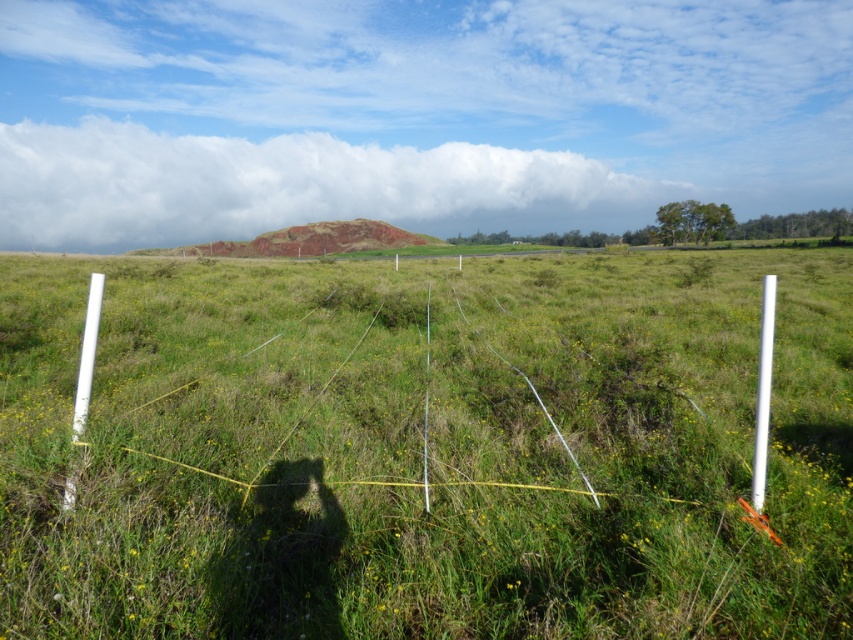
Looking at this image, who is taller, green grassy at center or white plastic pole at right?

green grassy at center is taller.

Who is more distant from viewer, [326,598] or [767,300]?

Point [767,300]

Which is behind, point (838, 298) or point (767, 433)?

Positioned behind is point (838, 298).

I want to click on green grassy at center, so click(428, 449).